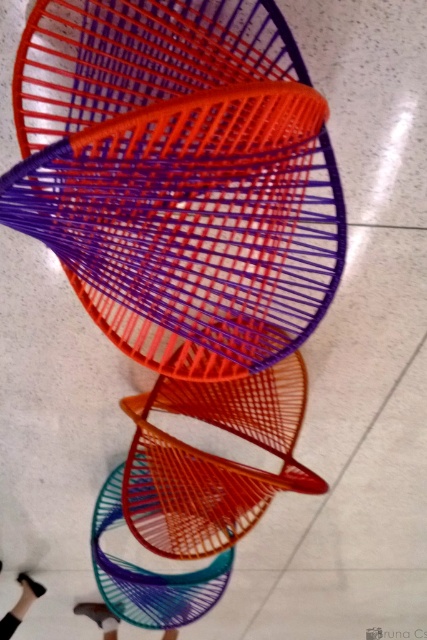
Locate an element on the screen. orange matte wire spiral at center is located at coordinates (178, 177).

Does orange matte wire spiral at center come behind orange matte chair at center?

That is False.

Is point (164, 204) closer to camera compared to point (166, 461)?

Yes.

The image size is (427, 640). Identify the location of orange matte wire spiral at center. (178, 177).

Does point (195, 492) come behind point (131, 616)?

No.

Which is below, orange matte chair at center or teal matte wire chair at center?

teal matte wire chair at center is below.

This screenshot has height=640, width=427. Identify the location of orange matte chair at center. (213, 460).

Does orange matte chair at center have a larger size compared to black leather shoe at lower left?

Correct, orange matte chair at center is larger in size than black leather shoe at lower left.

Can you confirm if orange matte chair at center is wider than black leather shoe at lower left?

Indeed, orange matte chair at center has a greater width compared to black leather shoe at lower left.

What are the coordinates of `orange matte chair at center` in the screenshot? It's located at (213, 460).

Locate an element on the screen. The image size is (427, 640). orange matte chair at center is located at coordinates (213, 460).